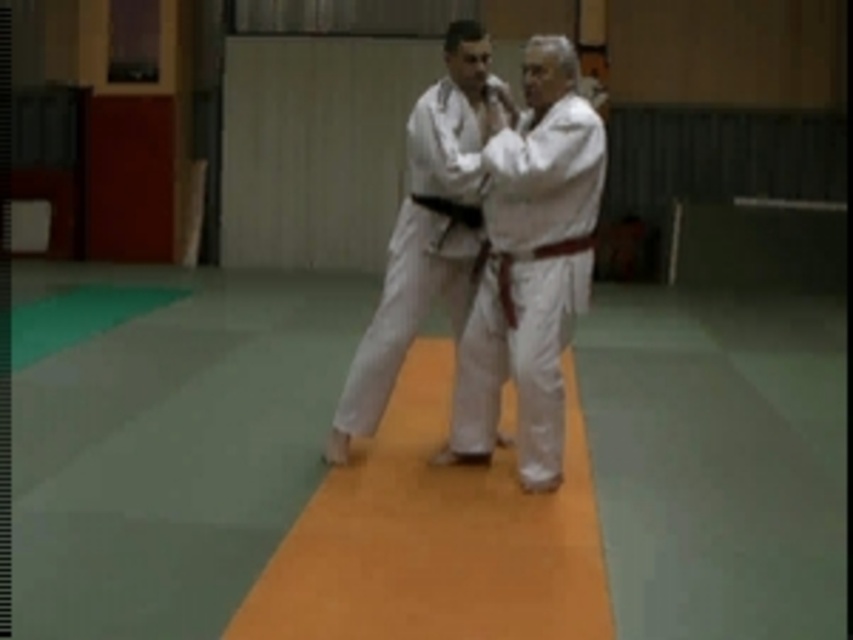
Question: Which point appears farthest from the camera in this image?

Choices:
 (A) (451, 209)
 (B) (389, 291)
 (C) (569, 248)

Answer: (A)

Question: Which point is closer to the camera taking this photo?

Choices:
 (A) (500, 257)
 (B) (428, 198)
 (C) (355, 364)

Answer: (A)

Question: Does white karate gi at center have a larger size compared to black leather belt at center?

Choices:
 (A) no
 (B) yes

Answer: (B)

Question: Does white matte kimono at center appear on the left side of white karate gi at center?

Choices:
 (A) yes
 (B) no

Answer: (B)

Question: Can you confirm if white matte kimono at center is positioned above white karate gi at center?

Choices:
 (A) no
 (B) yes

Answer: (B)

Question: Which is nearer to the black leather belt at center?

Choices:
 (A) white karate gi at center
 (B) white matte kimono at center

Answer: (A)